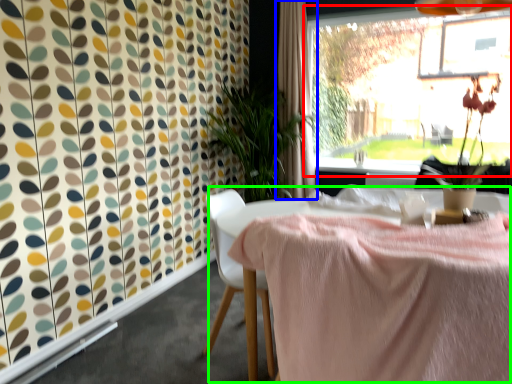
Question: Based on their relative distances, which object is farther from window (highlighted by a red box)? Choose from curtain (highlighted by a blue box) and table (highlighted by a green box).

Choices:
 (A) curtain
 (B) table

Answer: (B)